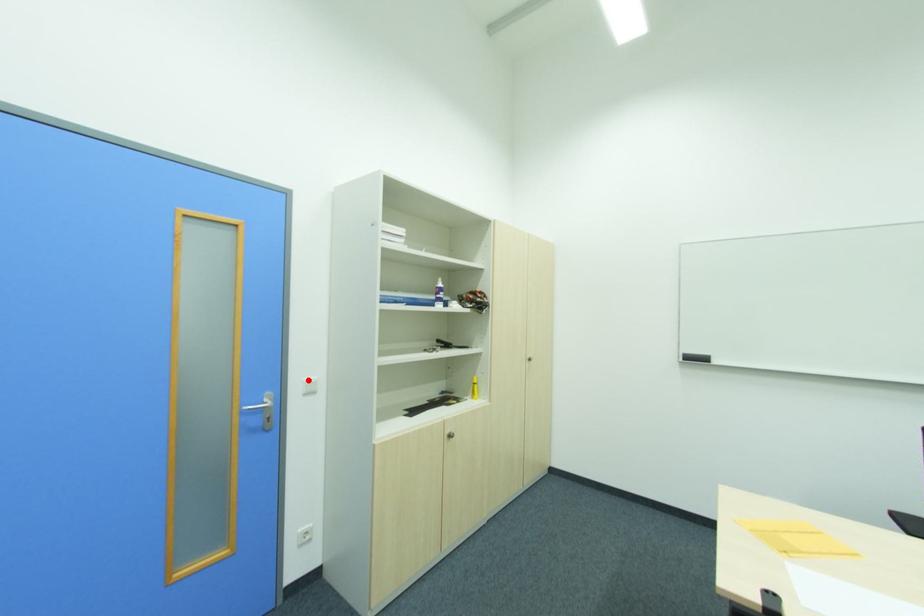
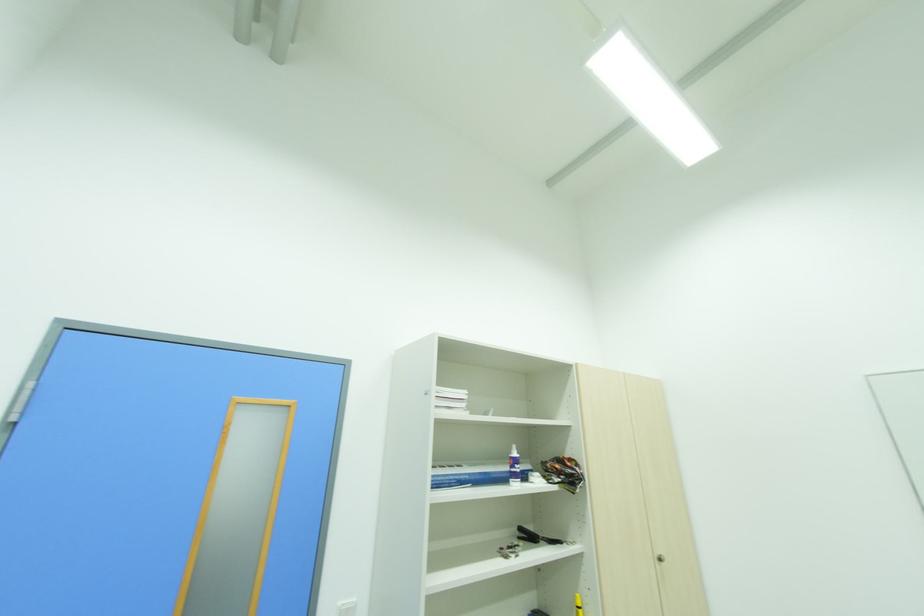
The point at the highlighted location is marked in the first image. Where is the corresponding point in the second image?

(344, 604)